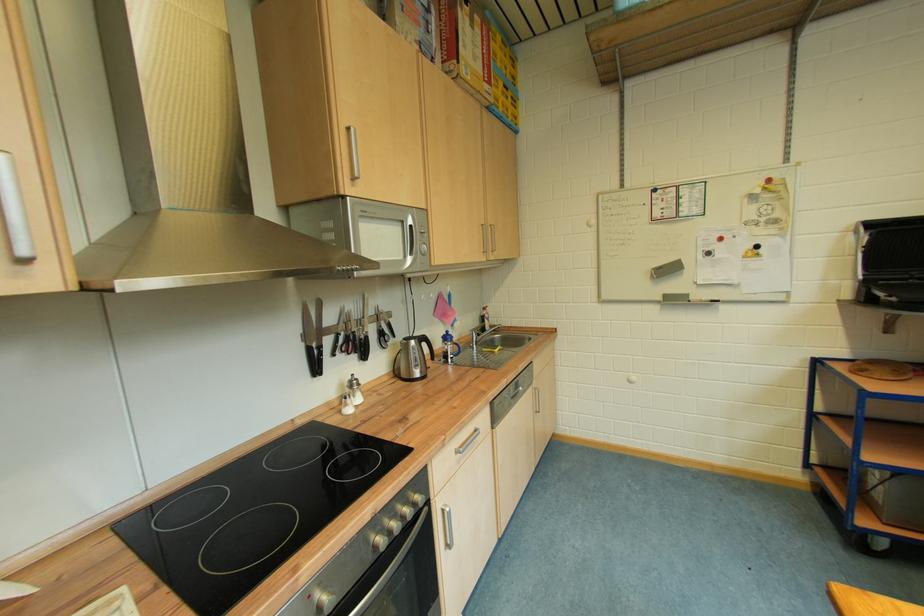
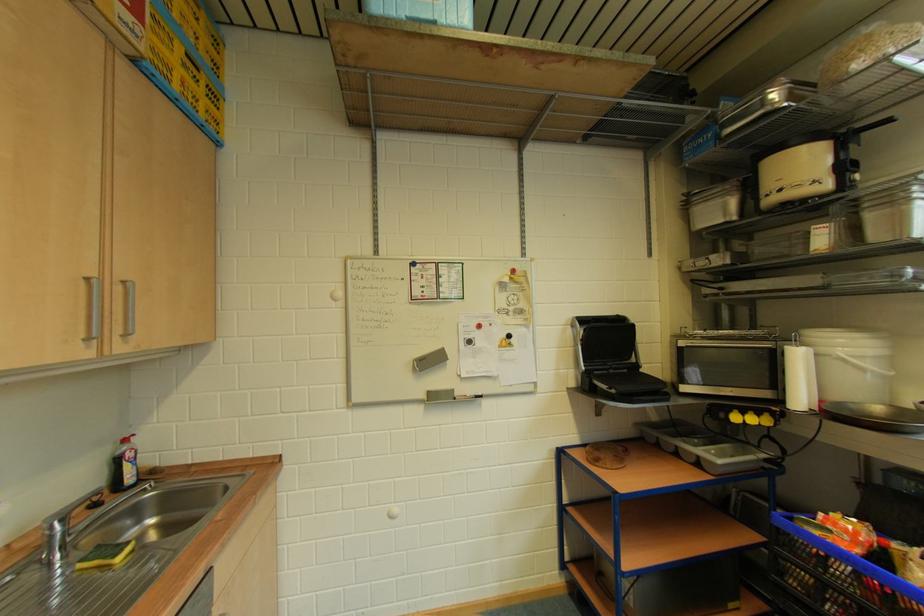
The point at (864, 235) is marked in the first image. Where is the corresponding point in the second image?

(579, 329)